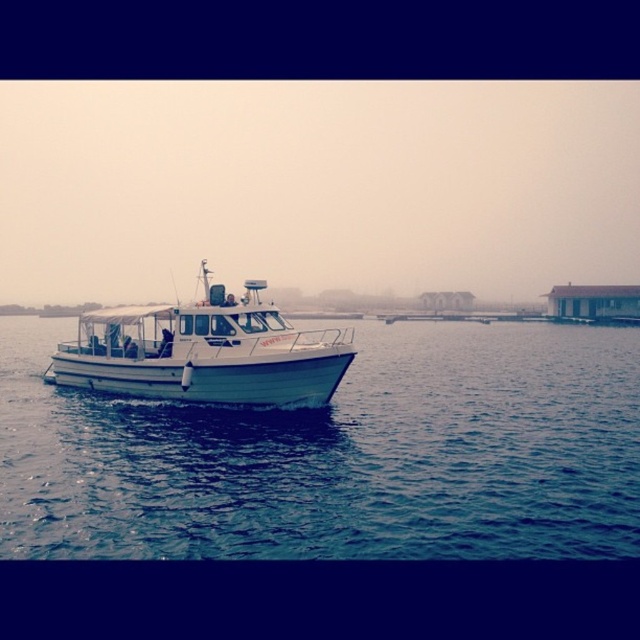
Question: Is blue water at center wider than white matte boat at center?

Choices:
 (A) no
 (B) yes

Answer: (B)

Question: Does blue water at center appear on the left side of white matte boat at center?

Choices:
 (A) no
 (B) yes

Answer: (A)

Question: Which of the following is the farthest from the observer?

Choices:
 (A) (192, 506)
 (B) (276, 380)

Answer: (B)

Question: Can you confirm if blue water at center is positioned below white matte boat at center?

Choices:
 (A) no
 (B) yes

Answer: (B)

Question: Which of the following is the closest to the observer?

Choices:
 (A) white matte boat at center
 (B) blue water at center

Answer: (B)